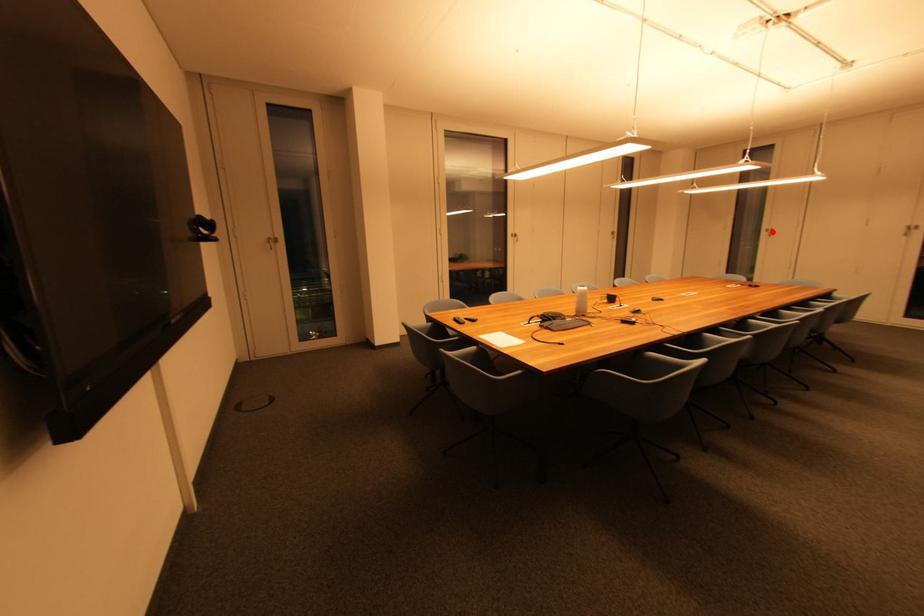
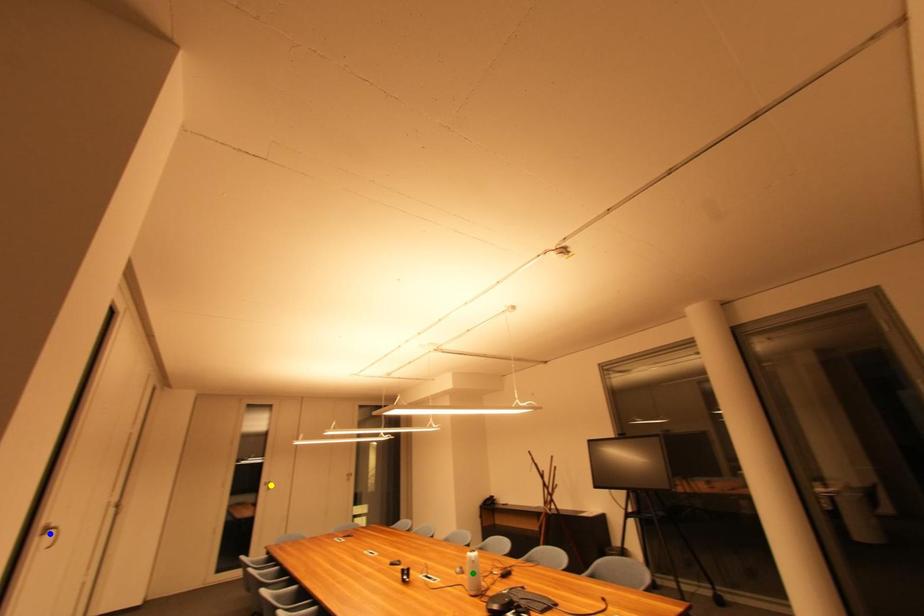
Question: I am providing you with two images of the same scene from different viewpoints. A red point is marked on the first image. You are given multiple points on the second image. Which point in image 2 represents the same 3d spot as the red point in image 1?

Choices:
 (A) yellow point
 (B) green point
 (C) blue point

Answer: (A)